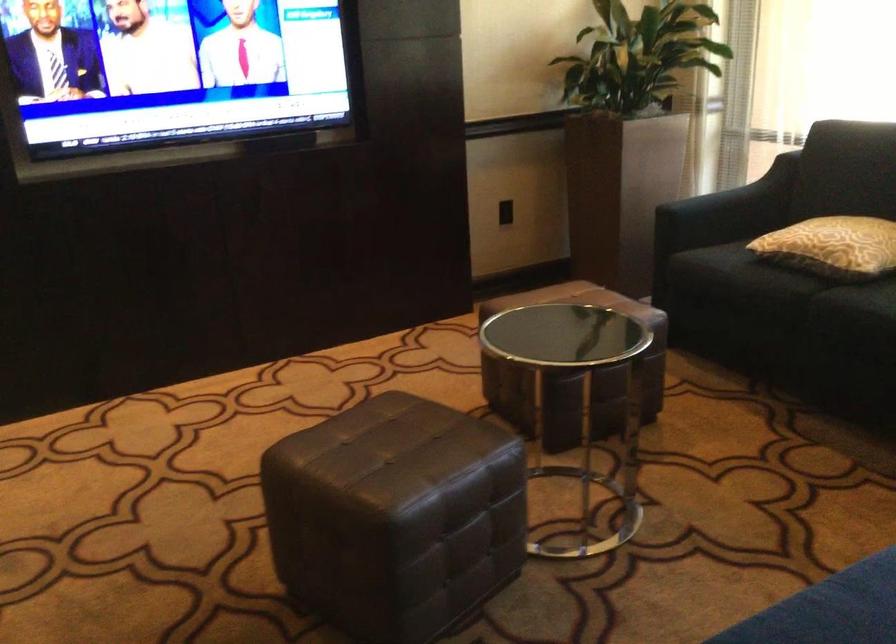
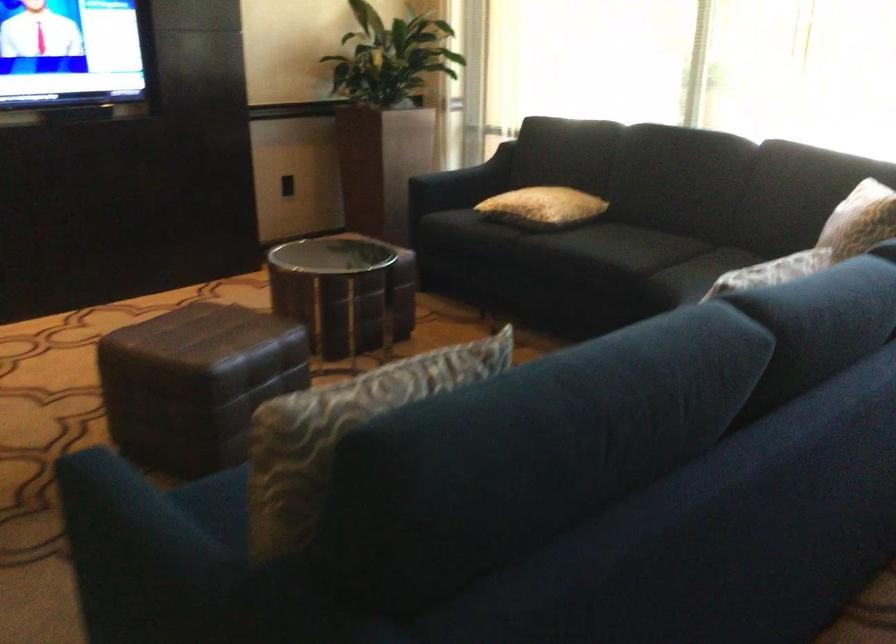
Question: Which direction would the cameraman need to move to produce the second image? Reply with the corresponding letter.

Choices:
 (A) Left
 (B) Right
 (C) Forward
 (D) Backward

Answer: (D)